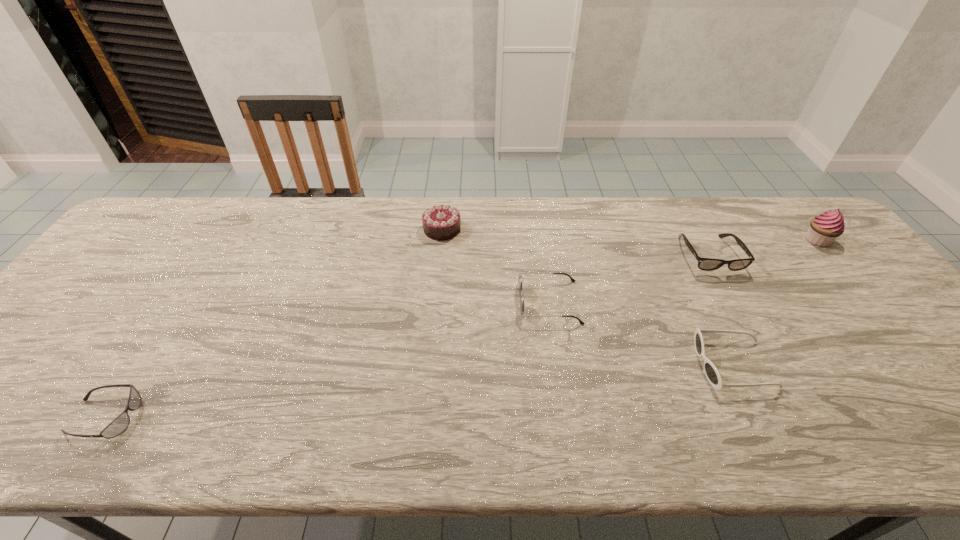
Where is `vacant area that lies between the rightmost object and the spectacles`? This screenshot has height=540, width=960. vacant area that lies between the rightmost object and the spectacles is located at coordinates (763, 248).

Identify the location of object that is the fifth closest to the farthest sunglasses. (119, 424).

The image size is (960, 540). Identify the location of object that ranks as the second closest to the cupcake. [x=711, y=372].

Locate an element on the screen. The height and width of the screenshot is (540, 960). sunglasses that can be found as the closest to the shortest object is located at coordinates 522,298.

What are the coordinates of `the third closest sunglasses to the spectacles` in the screenshot? It's located at (119, 424).

This screenshot has width=960, height=540. What are the coordinates of `free space in the image that satisfies the following two spatial constraints: 1. on the front side of the fifth shortest object; 2. on the lenses of the shortest sunglasses` in the screenshot? It's located at (424, 417).